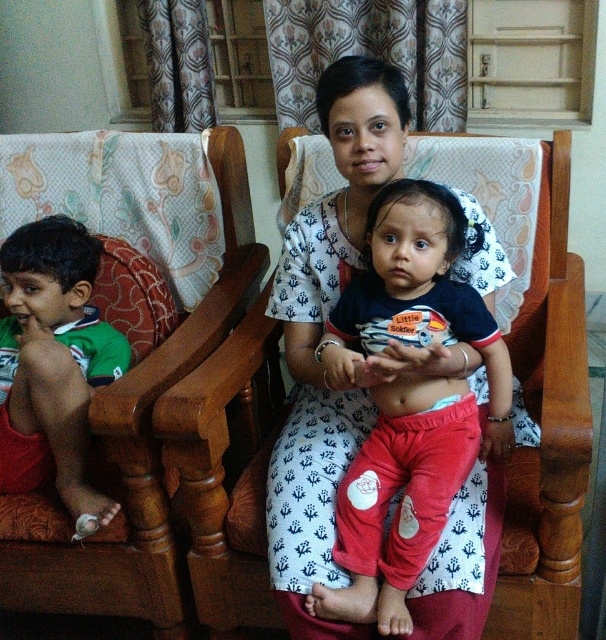
Who is lower down, wooden rocking chair at center or green jersey at left?

green jersey at left is below.

Locate an element on the screen. The height and width of the screenshot is (640, 606). wooden rocking chair at center is located at coordinates click(x=547, y=429).

Which is in front, point (430, 256) or point (228, 211)?

Point (430, 256) is in front.

Between matte black shirt at center and brown wood rocking chair at left, which one has more height?

brown wood rocking chair at left

Is point (401, 248) less distant than point (195, 333)?

That is True.

The image size is (606, 640). What are the coordinates of `matte black shirt at center` in the screenshot? It's located at 408,400.

Does brown wood rocking chair at left appear on the right side of green jersey at left?

Correct, you'll find brown wood rocking chair at left to the right of green jersey at left.

Looking at this image, is the position of brown wood rocking chair at left less distant than that of green jersey at left?

Yes, brown wood rocking chair at left is in front of green jersey at left.

This screenshot has height=640, width=606. Describe the element at coordinates (135, 452) in the screenshot. I see `brown wood rocking chair at left` at that location.

Find the location of a particular element. The height and width of the screenshot is (640, 606). brown wood rocking chair at left is located at coordinates (135, 452).